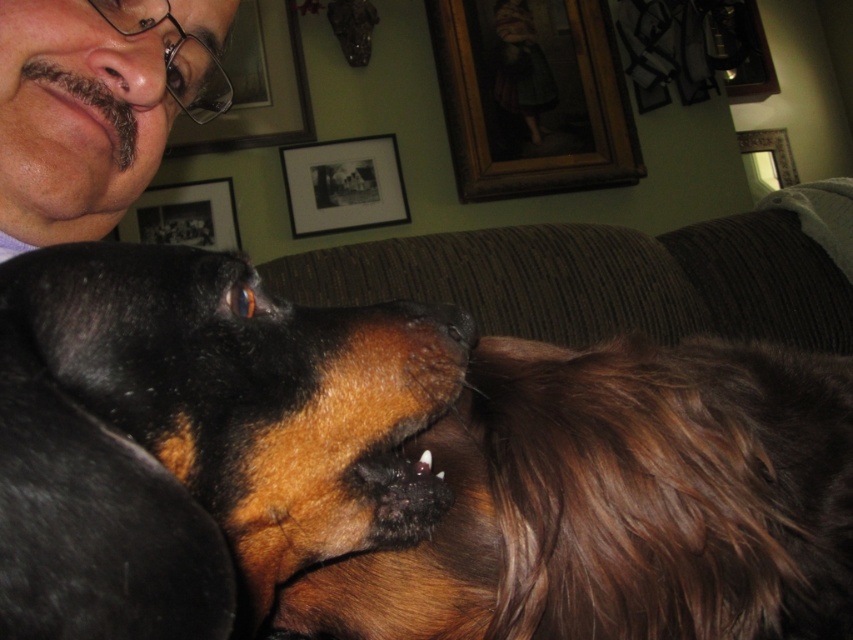
Question: Which of the following is the farthest from the observer?

Choices:
 (A) (9, 49)
 (B) (460, 68)
 (C) (403, 205)

Answer: (B)

Question: Among these objects, which one is farthest from the camera?

Choices:
 (A) wooden frame at upper center
 (B) brown fuzzy dog at center
 (C) black matte picture frame at upper center
 (D) wooden frame at upper right

Answer: (D)

Question: Is black fur dog at center wider than black matte picture frame at upper center?

Choices:
 (A) yes
 (B) no

Answer: (B)

Question: Based on their relative distances, which object is farther from the matte glass picture frame at upper left?

Choices:
 (A) matte black face at upper left
 (B) wooden frame at upper right
 (C) brown fuzzy dog at center

Answer: (B)

Question: Is black fur dog at center bigger than brown fuzzy dog at center?

Choices:
 (A) yes
 (B) no

Answer: (B)

Question: Can you confirm if matte glass picture frame at upper left is bigger than wooden frame at upper right?

Choices:
 (A) yes
 (B) no

Answer: (A)